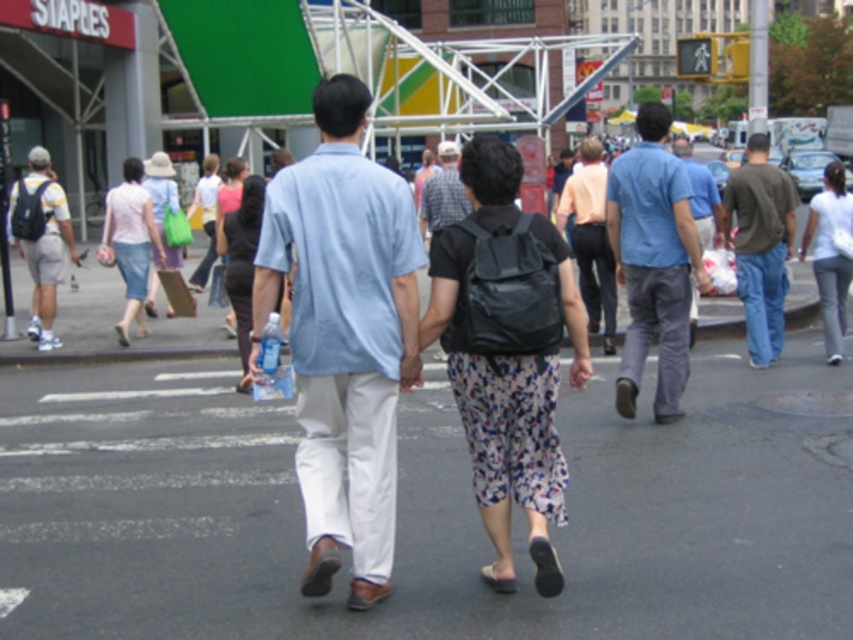
Question: Is light blue cotton shirt at center to the right of dark brown cotton shirt at right from the viewer's perspective?

Choices:
 (A) no
 (B) yes

Answer: (A)

Question: Can you confirm if dark brown cotton shirt at right is positioned to the left of matte black backpack at left?

Choices:
 (A) yes
 (B) no

Answer: (B)

Question: Which object is farther from the camera taking this photo?

Choices:
 (A) blue cotton shirt at center
 (B) floral fabric skirt at center

Answer: (B)

Question: Which of the following is the farthest from the observer?

Choices:
 (A) (440, 177)
 (B) (757, 355)
 (C) (39, 326)

Answer: (C)

Question: Which is nearer to the plaid shirt at center?

Choices:
 (A) light blue cotton shirt at center
 (B) dark brown cotton shirt at right
 (C) light pink fabric dress at center

Answer: (B)

Question: Is floral skirt at center further to camera compared to white cotton pants at lower right?

Choices:
 (A) no
 (B) yes

Answer: (A)